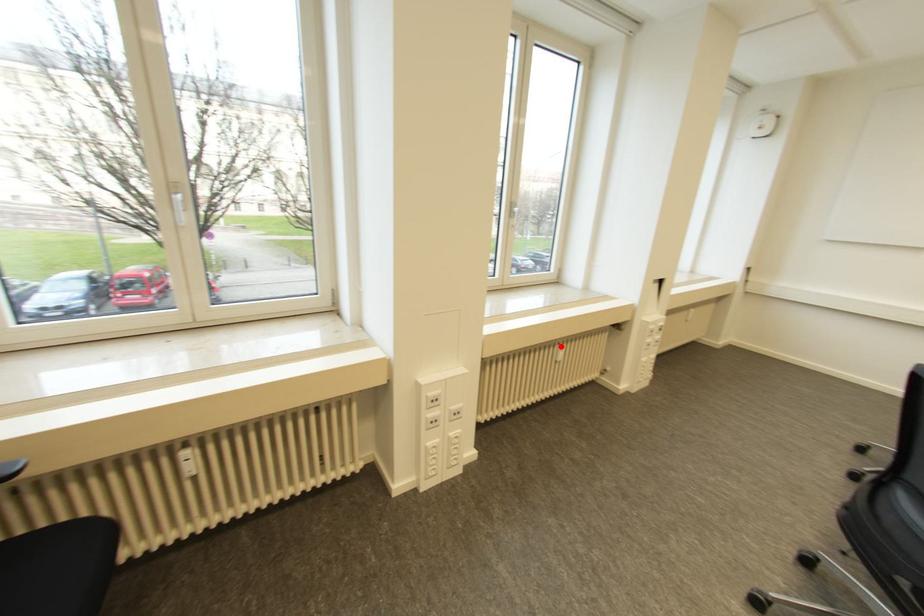
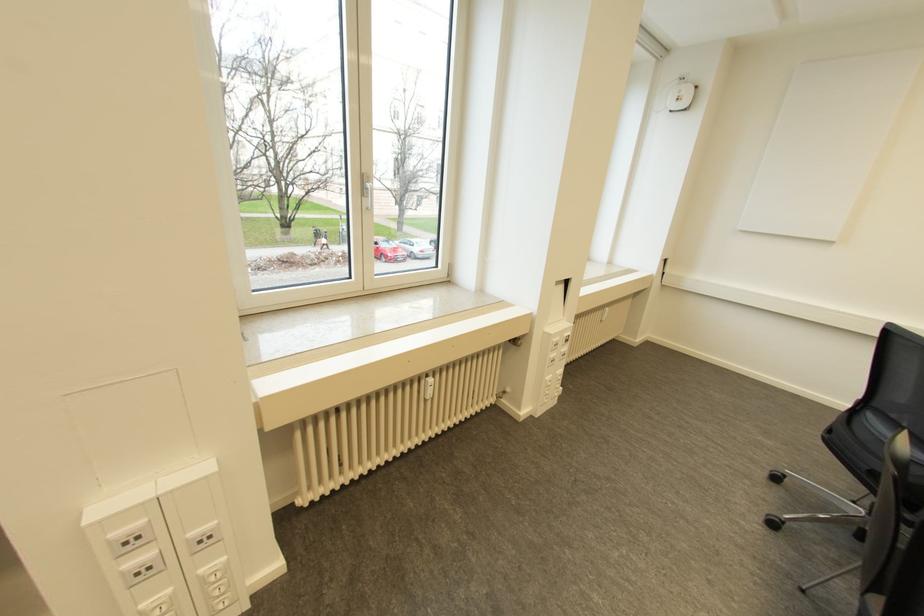
The point at the highlighted location is marked in the first image. Where is the corresponding point in the second image?

(430, 379)